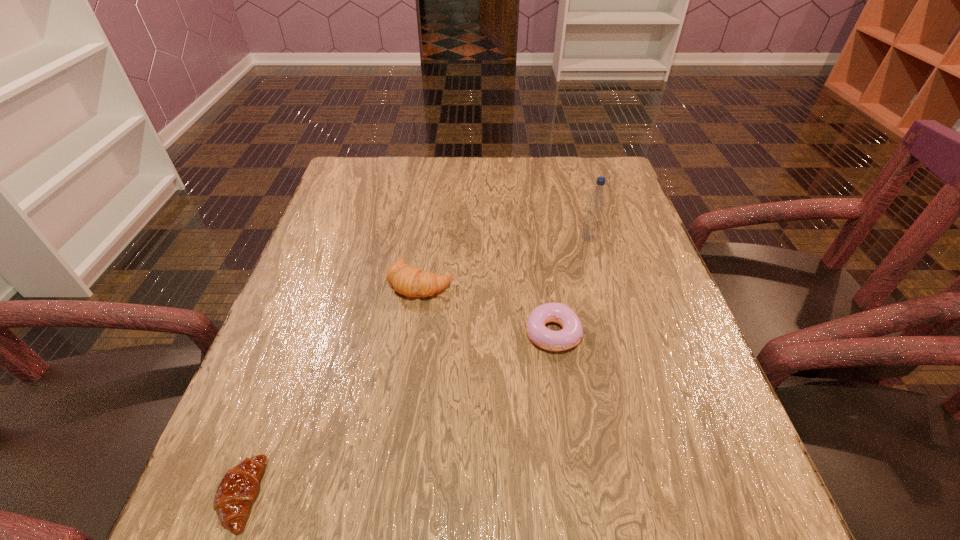
Where is `the tallest object`? The image size is (960, 540). the tallest object is located at coordinates (596, 202).

Locate an element on the screen. The height and width of the screenshot is (540, 960). water bottle is located at coordinates (596, 202).

I want to click on the second object from left to right, so click(x=409, y=281).

Where is `the taller crescent roll`? the taller crescent roll is located at coordinates (409, 281).

At what (x,y) coordinates should I click in order to perform the action: click on doughnut. Please return your answer as a coordinate pair (x, y). Image resolution: width=960 pixels, height=540 pixels. Looking at the image, I should click on (572, 332).

Where is `the second nearest object`? The image size is (960, 540). the second nearest object is located at coordinates tap(572, 332).

This screenshot has width=960, height=540. Find the location of `the nearest object`. the nearest object is located at coordinates (237, 489).

In order to click on the nearer crescent roll in this screenshot , I will do `click(237, 489)`.

Identify the location of free space located 0.090m on the back of the water bottle. (582, 212).

Locate an element on the screen. Image resolution: width=960 pixels, height=540 pixels. vacant space located 0.230m on the right of the right crescent roll is located at coordinates (557, 283).